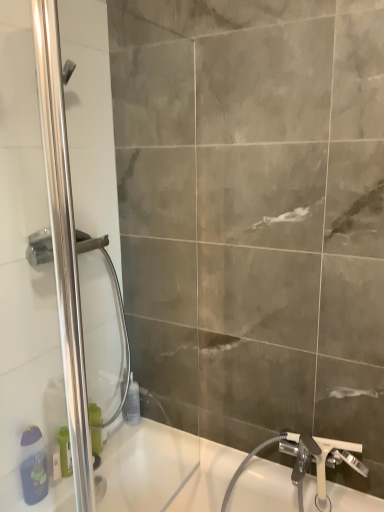
Question: Is matte purple soap dispenser at lower left, which appears as the 4th toiletry when viewed from the back, not close to white plastic bottle at lower left, which is counted as the third toiletry, starting from the right?

Choices:
 (A) no
 (B) yes

Answer: (A)

Question: From the image's perspective, is matte purple soap dispenser at lower left, the 1th toiletry positioned from the front, above white plastic bottle at lower left, which is counted as the third toiletry, starting from the right?

Choices:
 (A) yes
 (B) no

Answer: (A)

Question: Is matte purple soap dispenser at lower left, arranged as the first toiletry when viewed from the left, to the left of white plastic bottle at lower left, which is the second toiletry in left-to-right order, from the viewer's perspective?

Choices:
 (A) yes
 (B) no

Answer: (A)

Question: Is matte purple soap dispenser at lower left, arranged as the first toiletry when viewed from the left, beside white plastic bottle at lower left, the 2th toiletry when ordered from front to back?

Choices:
 (A) no
 (B) yes

Answer: (B)

Question: Is matte purple soap dispenser at lower left, the 1th toiletry positioned from the front, shorter than white plastic bottle at lower left, the 3th toiletry viewed from the back?

Choices:
 (A) yes
 (B) no

Answer: (B)

Question: Can white plastic bottle at lower left, the 2th toiletry when ordered from front to back, be found inside matte purple soap dispenser at lower left, the fourth toiletry from the right?

Choices:
 (A) no
 (B) yes

Answer: (A)

Question: Is matte purple soap dispenser at lower left, the fourth toiletry from the right, turned away from green plastic bottle at lower left, which ranks as the 2th toiletry in back-to-front order?

Choices:
 (A) yes
 (B) no

Answer: (B)

Question: Could you tell me if matte purple soap dispenser at lower left, arranged as the first toiletry when viewed from the left, is turned towards green plastic bottle at lower left, acting as the 3th toiletry starting from the left?

Choices:
 (A) yes
 (B) no

Answer: (B)

Question: Considering the relative sizes of matte purple soap dispenser at lower left, the fourth toiletry from the right, and green plastic bottle at lower left, acting as the 3th toiletry starting from the left, in the image provided, is matte purple soap dispenser at lower left, the fourth toiletry from the right, wider than green plastic bottle at lower left, acting as the 3th toiletry starting from the left,?

Choices:
 (A) yes
 (B) no

Answer: (B)

Question: From a real-world perspective, is matte purple soap dispenser at lower left, the 1th toiletry positioned from the front, on green plastic bottle at lower left, which ranks as the 2th toiletry in back-to-front order?

Choices:
 (A) no
 (B) yes

Answer: (B)

Question: Is matte purple soap dispenser at lower left, the fourth toiletry from the right, in front of green plastic bottle at lower left, acting as the 3th toiletry starting from the left?

Choices:
 (A) yes
 (B) no

Answer: (A)

Question: Is matte purple soap dispenser at lower left, arranged as the first toiletry when viewed from the left, not inside green plastic bottle at lower left, arranged as the 2th toiletry when viewed from the right?

Choices:
 (A) yes
 (B) no

Answer: (A)

Question: Considering the relative sizes of white plastic bottle at lower left, which is the second toiletry in left-to-right order, and white glossy bathtub at lower left in the image provided, is white plastic bottle at lower left, which is the second toiletry in left-to-right order, taller than white glossy bathtub at lower left?

Choices:
 (A) no
 (B) yes

Answer: (A)